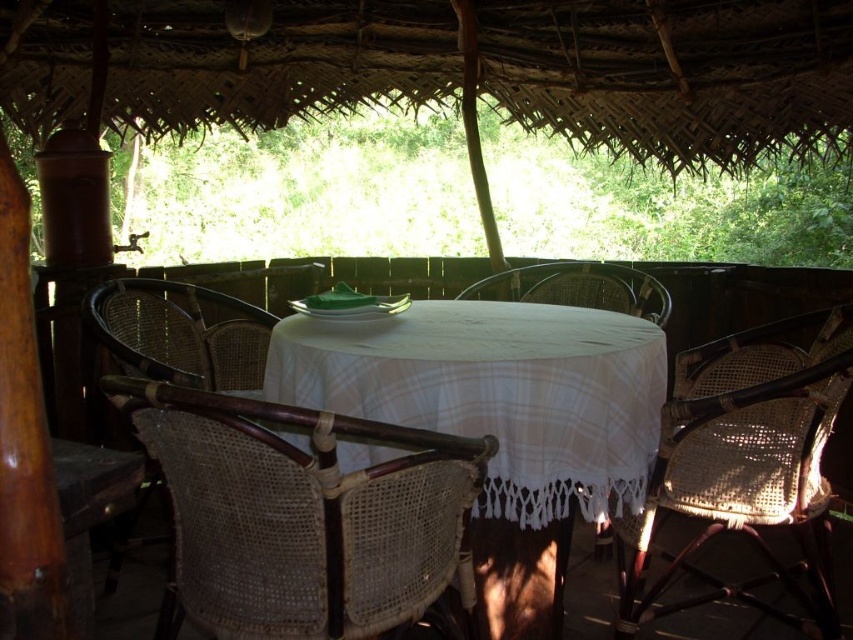
Question: From the image, what is the correct spatial relationship of white woven tablecloth at center in relation to woven rattan chair at left?

Choices:
 (A) above
 (B) below

Answer: (B)

Question: Which point is closer to the camera?

Choices:
 (A) woven cane chair at lower right
 (B) white woven tablecloth at center

Answer: (B)

Question: Can you confirm if white woven tablecloth at center is positioned below woven rattan chair at center?

Choices:
 (A) yes
 (B) no

Answer: (A)

Question: Which object is closer to the camera taking this photo?

Choices:
 (A) woven rattan chair at left
 (B) woven cane chair at lower right
 (C) white woven tablecloth at center

Answer: (C)

Question: Which is nearer to the woven rattan chair at center?

Choices:
 (A) woven cane chair at center
 (B) white woven tablecloth at center
 (C) woven rattan chair at left
 (D) woven cane chair at lower right

Answer: (B)

Question: Does woven cane chair at center lie behind woven cane chair at lower right?

Choices:
 (A) yes
 (B) no

Answer: (B)